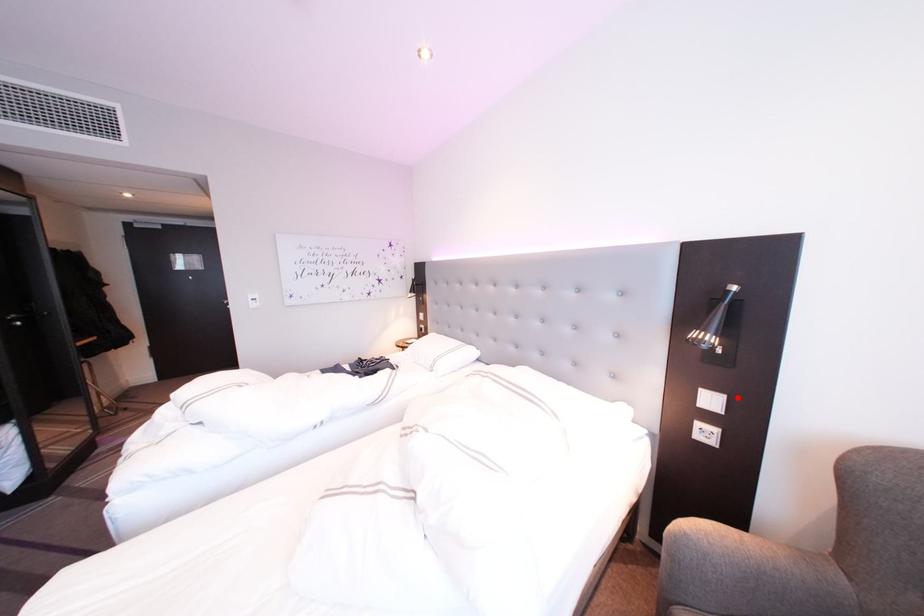
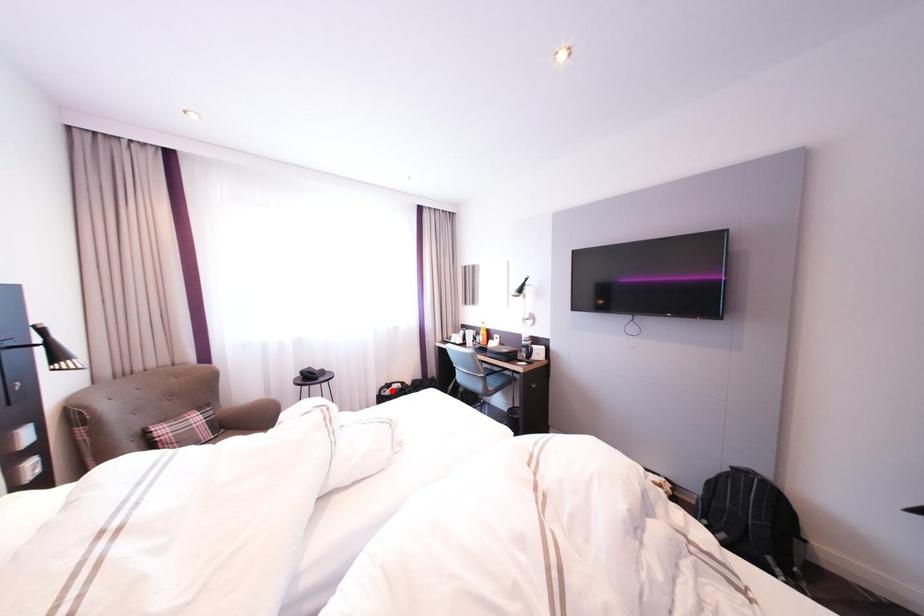
I am providing you with two images of the same scene from different viewpoints. A red point is marked on the first image and another point is marked on the second image. Is the red point in image1 aligned with the point shown in image2?

No